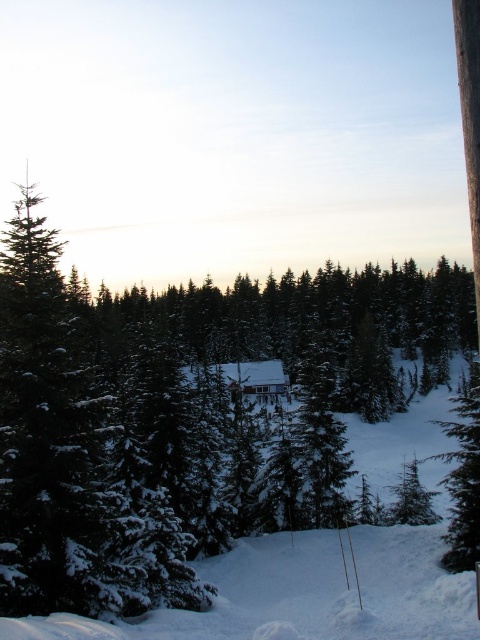
Looking at this image, you are planning to ski down the white snow ski slope at lower center to reach the wooden cabin at center. Given that the slope is 63.34 meters away from the cabin, do you think you can make it in one run without stopping?

The white snow ski slope at lower center is 63.34 meters away from the wooden cabin at center, so yes, you can make it in one run without stopping as the distance is manageable for a single ski descent.

You are planning to build a ski lift from the wooden cabin at center to the white snow ski slope at lower center. Which location should the ski lift start from to ensure it can reach the other without needing to go uphill?

The ski lift should start from the wooden cabin at center because it is taller than the white snow ski slope at lower center, allowing the lift to descend towards the slope without needing to climb uphill.